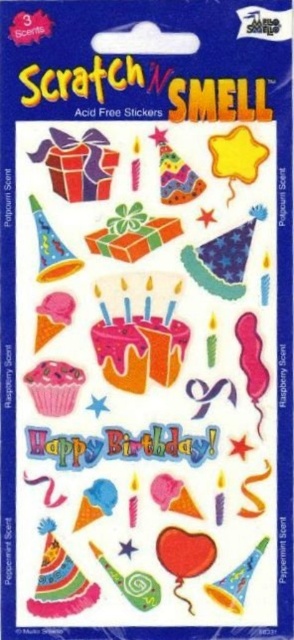
Question: Among these objects, which one is farthest from the camera?

Choices:
 (A) pink glossy cupcake at center-left
 (B) matte pink cupcake at lower left

Answer: (B)

Question: From the image, what is the correct spatial relationship of pink glossy cupcake at center-left in relation to matte pink cupcake at lower left?

Choices:
 (A) below
 (B) above

Answer: (A)

Question: Which of the following is the closest to the observer?

Choices:
 (A) (40, 401)
 (B) (49, 314)

Answer: (A)

Question: Does pink glossy cupcake at center-left have a greater width compared to matte pink cupcake at lower left?

Choices:
 (A) no
 (B) yes

Answer: (B)

Question: Is pink glossy cupcake at center-left positioned before matte pink cupcake at lower left?

Choices:
 (A) no
 (B) yes

Answer: (B)